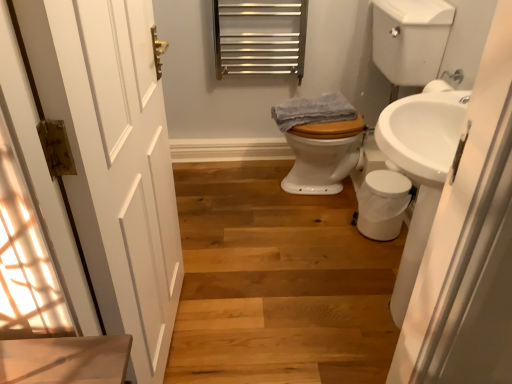
I want to click on blank area beneath white glossy sink at right (from a real-world perspective), so click(378, 316).